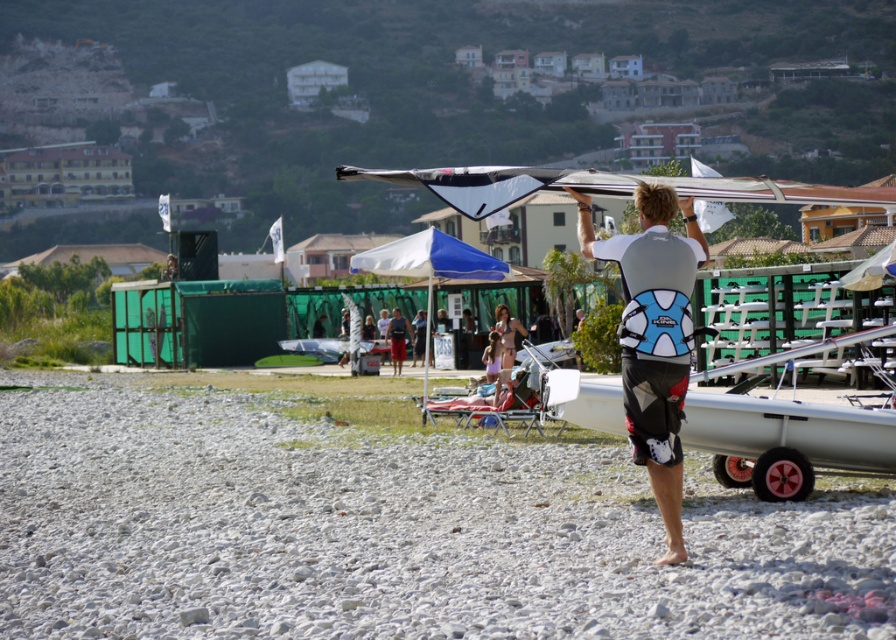
Consider the image. Does white matte wetsuit at center appear over matte pink dress at center?

Indeed, white matte wetsuit at center is positioned over matte pink dress at center.

Which is behind, point (644, 342) or point (521, 330)?

Point (521, 330)

Measure the distance between white matte wetsuit at center and camera.

9.95 meters

I want to click on white matte wetsuit at center, so click(x=653, y=337).

Is white gravel beach at center smaller than matte pink dress at center?

Incorrect, white gravel beach at center is not smaller in size than matte pink dress at center.

Which is above, white gravel beach at center or matte pink dress at center?

matte pink dress at center

Between point (445, 435) and point (496, 316), which one is positioned behind?

Point (496, 316)

Locate an element on the screen. white gravel beach at center is located at coordinates (389, 524).

Is white gravel beach at center behind white matte wetsuit at center?

No, it is not.

Between white gravel beach at center and white matte wetsuit at center, which one has less height?

Standing shorter between the two is white matte wetsuit at center.

The image size is (896, 640). I want to click on white gravel beach at center, so click(389, 524).